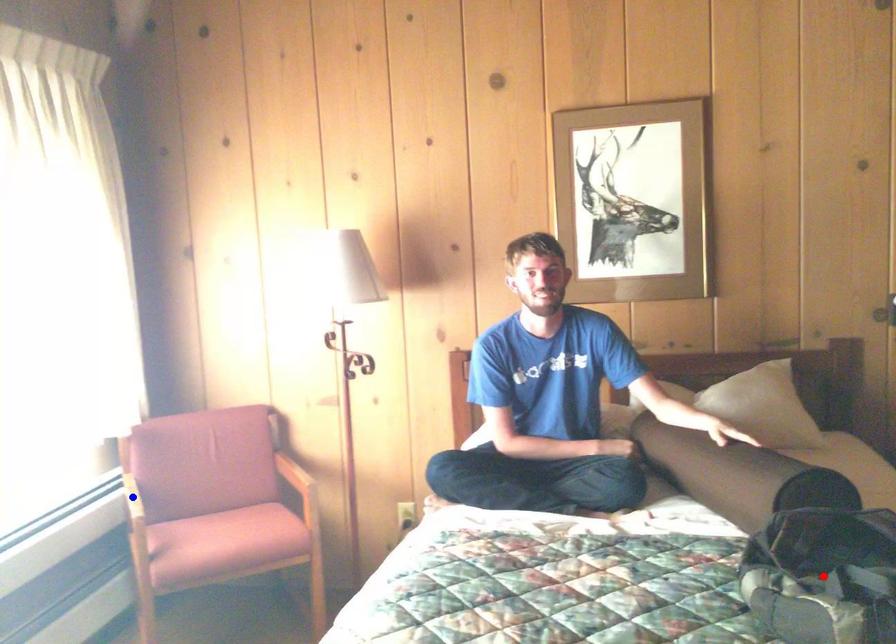
Question: Which of the two points in the image is closer to the camera?

Choices:
 (A) Blue point is closer.
 (B) Red point is closer.

Answer: (B)